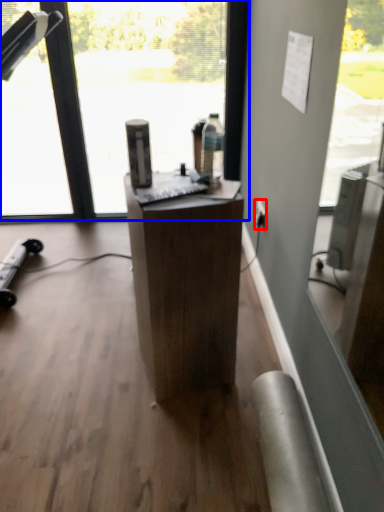
Question: Which point is further to the camera, power outlet (highlighted by a red box) or window (highlighted by a blue box)?

Choices:
 (A) power outlet
 (B) window

Answer: (A)